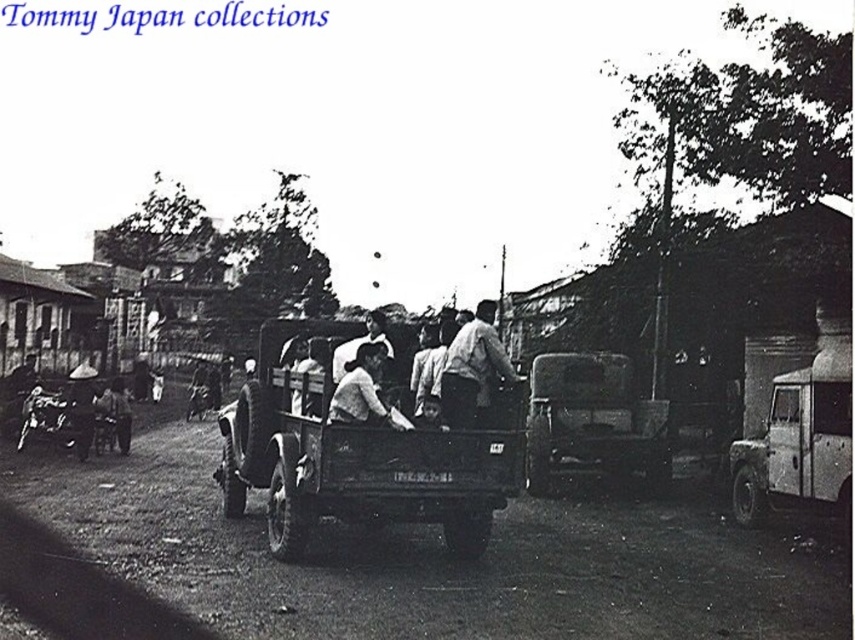
Question: Which object is positioned farthest from the smooth white shirt at center?

Choices:
 (A) smooth skin man at center
 (B) light brown leather jacket at center
 (C) metallic silver pickup truck at center
 (D) metallic truck bed at center

Answer: (C)

Question: Which of the following is the closest to the observer?

Choices:
 (A) light brown leather jacket at center
 (B) smooth white shirt at center
 (C) smooth skin man at center
 (D) metallic truck bed at center

Answer: (B)

Question: Does metallic truck bed at center appear under smooth white shirt at center?

Choices:
 (A) yes
 (B) no

Answer: (A)

Question: Is metallic truck bed at center to the right of metallic silver pickup truck at center from the viewer's perspective?

Choices:
 (A) no
 (B) yes

Answer: (A)

Question: Can you confirm if light brown leather jacket at center is positioned below smooth white shirt at center?

Choices:
 (A) yes
 (B) no

Answer: (B)

Question: Which object is closer to the camera taking this photo?

Choices:
 (A) light brown leather jacket at center
 (B) metallic silver pickup truck at center
 (C) smooth white shirt at center

Answer: (C)